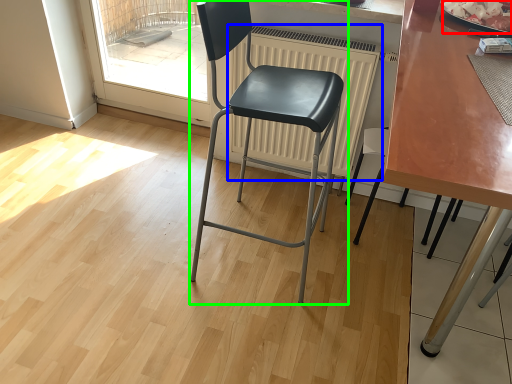
Question: Considering the real-world distances, which object is farthest from food (highlighted by a red box)? radiator (highlighted by a blue box) or chair (highlighted by a green box)?

Choices:
 (A) radiator
 (B) chair

Answer: (B)